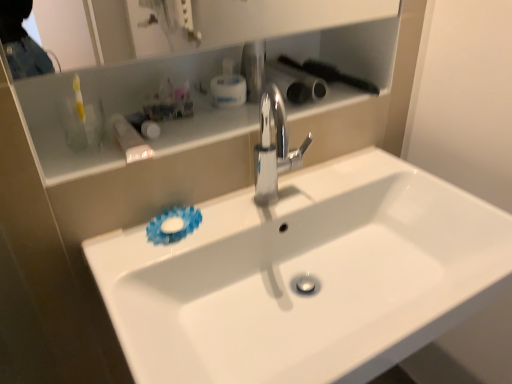
Where is `polished chrome faucet at center`? This screenshot has height=384, width=512. polished chrome faucet at center is located at coordinates (273, 147).

The height and width of the screenshot is (384, 512). What are the coordinates of `translucent plastic container at upper left` in the screenshot? It's located at (128, 139).

From the image's perspective, which one is positioned lower, white glossy sink at center or white glossy cabinet at upper center?

From the image's view, white glossy sink at center is below.

Is white glossy sink at center positioned with its back to white glossy cabinet at upper center?

No.

Does white glossy sink at center have a lesser width compared to white glossy cabinet at upper center?

No, white glossy sink at center is not thinner than white glossy cabinet at upper center.

How many degrees apart are the facing directions of white glossy cabinet at upper center and translucent plastic container at upper left?

white glossy cabinet at upper center and translucent plastic container at upper left are facing 1.58 degrees away from each other.

From the image's perspective, would you say white glossy cabinet at upper center is positioned over translucent plastic container at upper left?

Yes, from the image's perspective, white glossy cabinet at upper center is on top of translucent plastic container at upper left.

From a real-world perspective, relative to translucent plastic container at upper left, is white glossy cabinet at upper center vertically above or below?

Clearly, from a real-world perspective, white glossy cabinet at upper center is above translucent plastic container at upper left.

Is point (228, 206) positioned in front of point (273, 193)?

That is True.

From the picture: Which object is further away from the camera taking this photo, white glossy sink at center or polished chrome faucet at center?

polished chrome faucet at center is more distant.

Which object is thinner, white glossy sink at center or polished chrome faucet at center?

polished chrome faucet at center.

Is white glossy sink at center in contact with polished chrome faucet at center?

white glossy sink at center and polished chrome faucet at center are not in contact.

Does translucent plastic container at upper left have a larger size compared to white glossy cabinet at upper center?

No, translucent plastic container at upper left is not bigger than white glossy cabinet at upper center.

Are translucent plastic container at upper left and white glossy cabinet at upper center far apart?

They are positioned close to each other.

Which of these two, translucent plastic container at upper left or white glossy cabinet at upper center, stands taller?

translucent plastic container at upper left is taller.

Looking at their sizes, would you say translucent plastic container at upper left is wider or thinner than white glossy cabinet at upper center?

Clearly, translucent plastic container at upper left has more width compared to white glossy cabinet at upper center.

Considering the sizes of objects white glossy sink at center and translucent plastic container at upper left in the image provided, who is thinner, white glossy sink at center or translucent plastic container at upper left?

translucent plastic container at upper left is thinner.

Based on the photo, would you say white glossy sink at center is to the left or to the right of translucent plastic container at upper left in the picture?

From the image, it's evident that white glossy sink at center is to the right of translucent plastic container at upper left.

From a real-world perspective, which is physically above, white glossy sink at center or translucent plastic container at upper left?

In real-world perspective, translucent plastic container at upper left is above.

Which is behind, point (219, 275) or point (121, 124)?

The point (121, 124) is farther.

Is white glossy sink at center at the back of polished chrome faucet at center?

No.

Can you tell me how much polished chrome faucet at center and white glossy sink at center differ in facing direction?

There is a 1.68-degree angle between the facing directions of polished chrome faucet at center and white glossy sink at center.

Considering the relative sizes of polished chrome faucet at center and white glossy sink at center in the image provided, is polished chrome faucet at center taller than white glossy sink at center?

No.

From a real-world perspective, is translucent plastic container at upper left under white glossy sink at center?

No, from a real-world perspective, translucent plastic container at upper left is not under white glossy sink at center.

From the image's perspective, is translucent plastic container at upper left beneath white glossy sink at center?

Incorrect, from the image's perspective, translucent plastic container at upper left is higher than white glossy sink at center.

Is white glossy sink at center inside translucent plastic container at upper left?

No.

What's the angular difference between translucent plastic container at upper left and white glossy sink at center's facing directions?

The angular difference between translucent plastic container at upper left and white glossy sink at center is 1.68 degrees.

The image size is (512, 384). Find the location of `cabinet above the white glossy sink at center (from the image's perspective)`. cabinet above the white glossy sink at center (from the image's perspective) is located at coordinates (60, 132).

Identify the location of cabinet that is in front of the translucent plastic container at upper left. The height and width of the screenshot is (384, 512). (60, 132).

From the image, which object appears to be nearer to white glossy cabinet at upper center, polished chrome faucet at center or white glossy sink at center?

polished chrome faucet at center is positioned closer to the anchor white glossy cabinet at upper center.

From the image, which object appears to be farther from translucent plastic container at upper left, polished chrome faucet at center or white glossy cabinet at upper center?

polished chrome faucet at center lies further to translucent plastic container at upper left than the other object.

When comparing their distances from polished chrome faucet at center, does white glossy cabinet at upper center or white glossy sink at center seem further?

white glossy sink at center is positioned further to the anchor polished chrome faucet at center.

When comparing their distances from polished chrome faucet at center, does translucent plastic container at upper left or white glossy sink at center seem further?

Among the two, translucent plastic container at upper left is located further to polished chrome faucet at center.

Considering their positions, is translucent plastic container at upper left positioned closer to white glossy cabinet at upper center than white glossy sink at center?

Based on the image, translucent plastic container at upper left appears to be nearer to white glossy cabinet at upper center.

Considering their positions, is polished chrome faucet at center positioned closer to white glossy sink at center than translucent plastic container at upper left?

polished chrome faucet at center.

From the image, which object appears to be nearer to translucent plastic container at upper left, white glossy sink at center or white glossy cabinet at upper center?

Among the two, white glossy cabinet at upper center is located nearer to translucent plastic container at upper left.

Estimate the real-world distances between objects in this image. Which object is further from translucent plastic container at upper left, polished chrome faucet at center or white glossy sink at center?

white glossy sink at center is further to translucent plastic container at upper left.

Identify the location of toiletry between white glossy cabinet at upper center and white glossy sink at center in the up-down direction. (128, 139).

Find the location of a particular element. This screenshot has width=512, height=384. tap that lies between white glossy cabinet at upper center and white glossy sink at center from top to bottom is located at coordinates (273, 147).

The image size is (512, 384). Find the location of `cabinet between translucent plastic container at upper left and polished chrome faucet at center in the horizontal direction`. cabinet between translucent plastic container at upper left and polished chrome faucet at center in the horizontal direction is located at coordinates (60, 132).

Find the location of `tap between translucent plastic container at upper left and white glossy sink at center in the horizontal direction`. tap between translucent plastic container at upper left and white glossy sink at center in the horizontal direction is located at coordinates (273, 147).